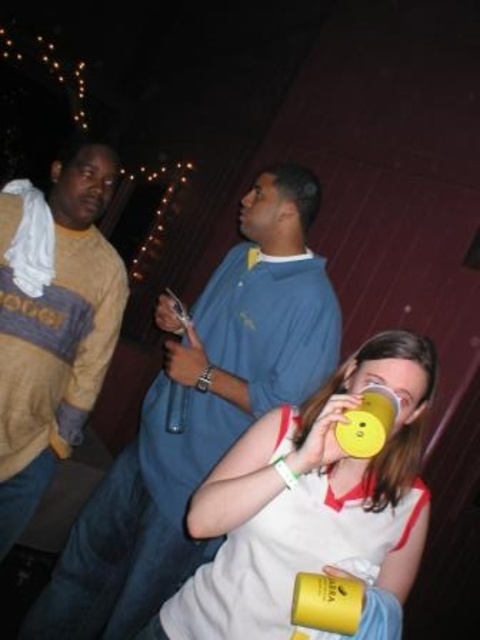
Question: Among these objects, which one is farthest from the camera?

Choices:
 (A) matte blue shirt at center
 (B) yellow matte cup at lower right
 (C) yellow matte cup at lower center
 (D) yellow matte cup at center

Answer: (A)

Question: Can you confirm if yellow matte cup at lower right is positioned to the left of yellow matte cup at lower center?

Choices:
 (A) yes
 (B) no

Answer: (A)

Question: Estimate the real-world distances between objects in this image. Which object is farther from the yellow matte cup at lower center?

Choices:
 (A) matte blue shirt at center
 (B) beige sweater at left
 (C) yellow matte cup at lower right
 (D) yellow matte cup at center

Answer: (B)

Question: Is yellow matte cup at center to the right of yellow matte cup at lower right from the viewer's perspective?

Choices:
 (A) yes
 (B) no

Answer: (B)

Question: Considering the real-world distances, which object is closest to the yellow matte cup at lower center?

Choices:
 (A) matte blue shirt at center
 (B) yellow matte cup at lower right
 (C) beige sweater at left

Answer: (B)

Question: In this image, where is beige sweater at left located relative to yellow matte cup at lower right?

Choices:
 (A) above
 (B) below

Answer: (A)